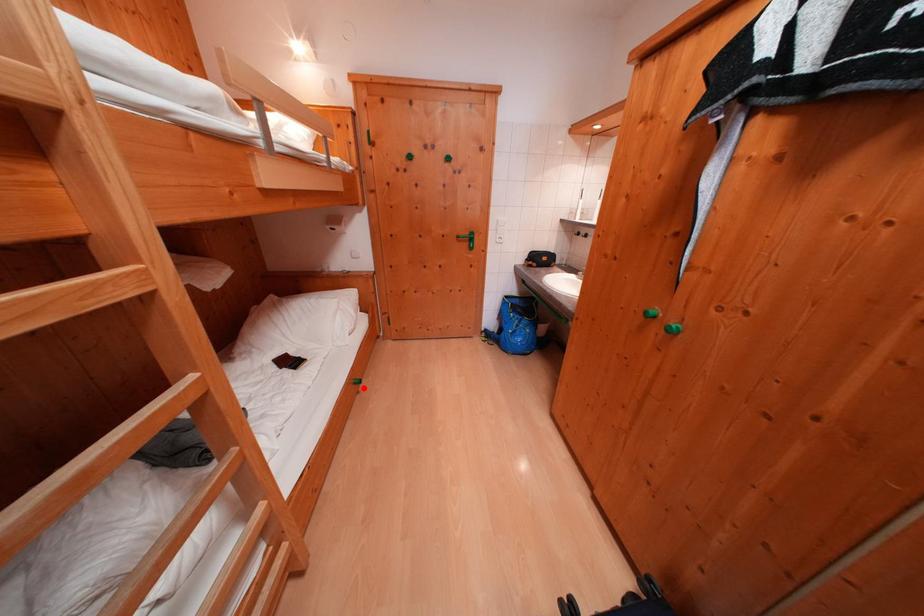
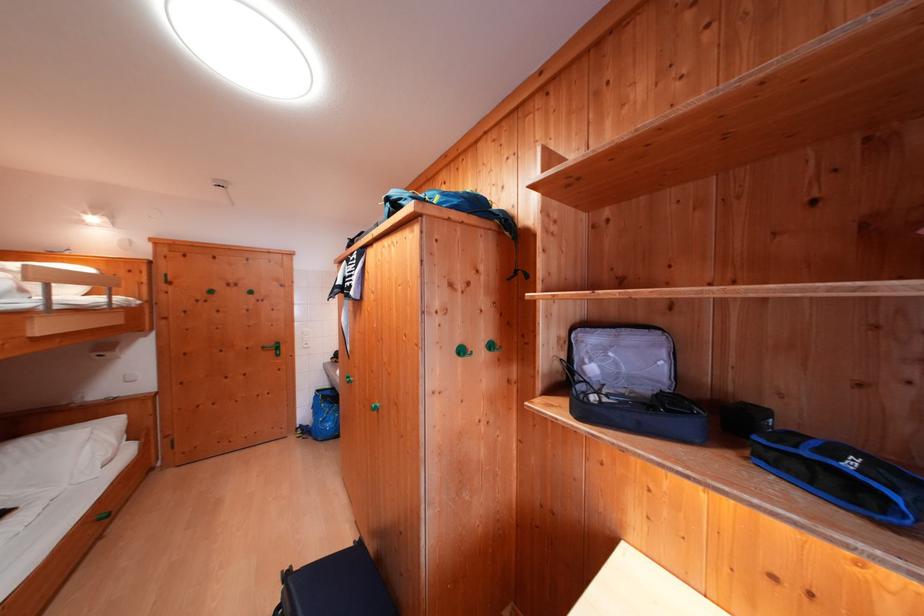
The point at the highlighted location is marked in the first image. Where is the corresponding point in the second image?

(108, 524)